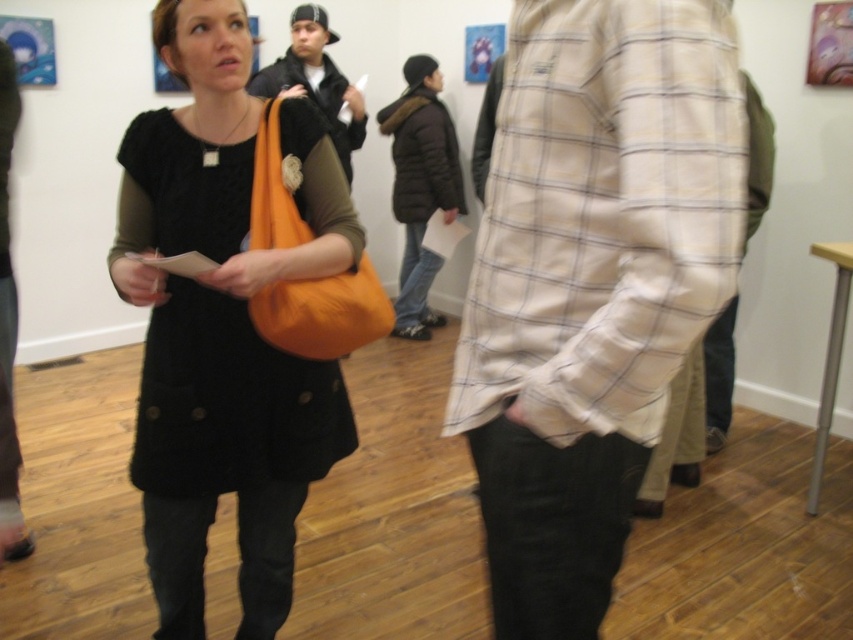
Question: Which of the following is the closest to the observer?

Choices:
 (A) (453, 392)
 (B) (287, 92)

Answer: (A)

Question: Based on their relative distances, which object is farther from the light beige plaid shirt at center?

Choices:
 (A) matte black jacket at center
 (B) orange fabric bag at upper left

Answer: (A)

Question: Does light beige plaid shirt at center appear on the left side of orange fabric bag at upper left?

Choices:
 (A) no
 (B) yes

Answer: (A)

Question: Where is orange fabric bag at upper left located in relation to matte black jacket at center in the image?

Choices:
 (A) above
 (B) below

Answer: (B)

Question: Is light beige plaid shirt at center bigger than orange fabric bag at upper left?

Choices:
 (A) yes
 (B) no

Answer: (B)

Question: Which point is farther to the camera?

Choices:
 (A) orange fabric bag at upper left
 (B) matte black jacket at center
 (C) light beige plaid shirt at center

Answer: (B)